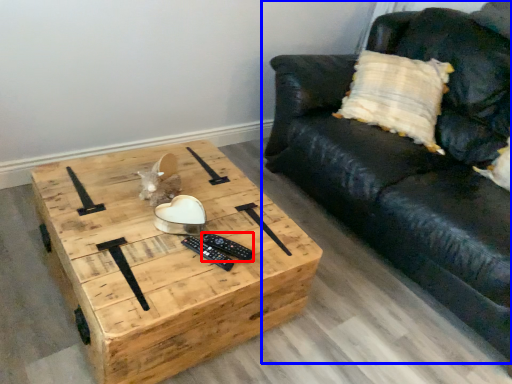
Question: Which object appears closest to the camera in this image, remote (highlighted by a red box) or studio couch (highlighted by a blue box)?

Choices:
 (A) remote
 (B) studio couch

Answer: (B)